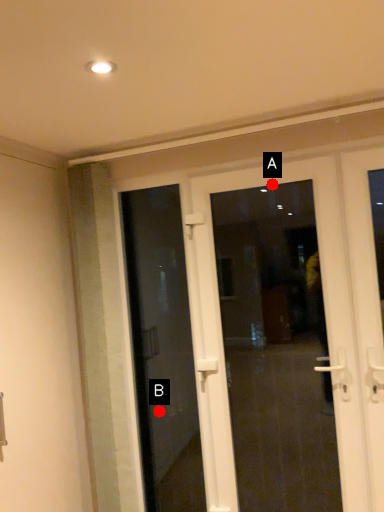
Question: Two points are circled on the image, labeled by A and B beside each circle. Which of the following is the farthest from the observer?

Choices:
 (A) A is further
 (B) B is further

Answer: (B)